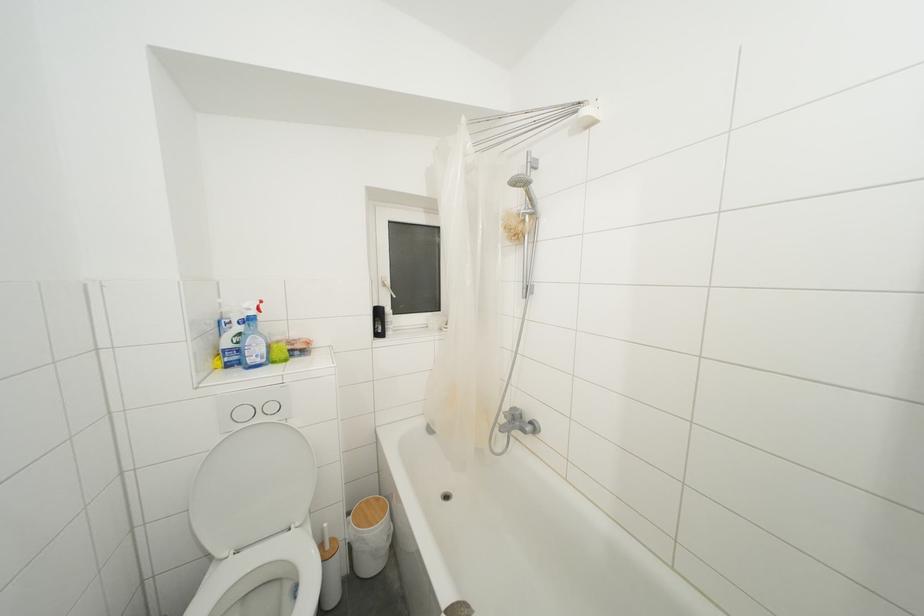
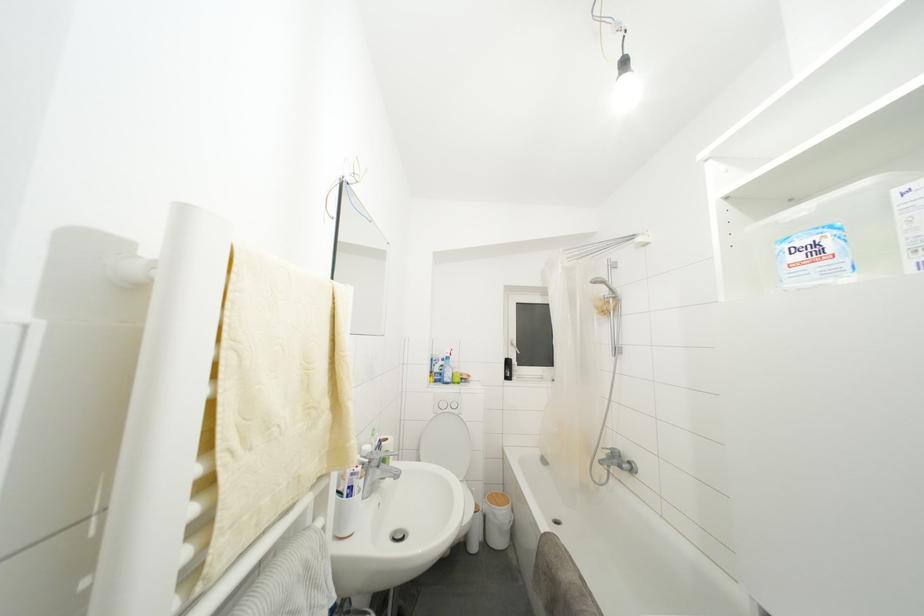
Question: Based on the continuous images, in which direction is the camera rotating? Reply with the corresponding letter.

Choices:
 (A) Left
 (B) Right
 (C) Up
 (D) Down

Answer: (A)